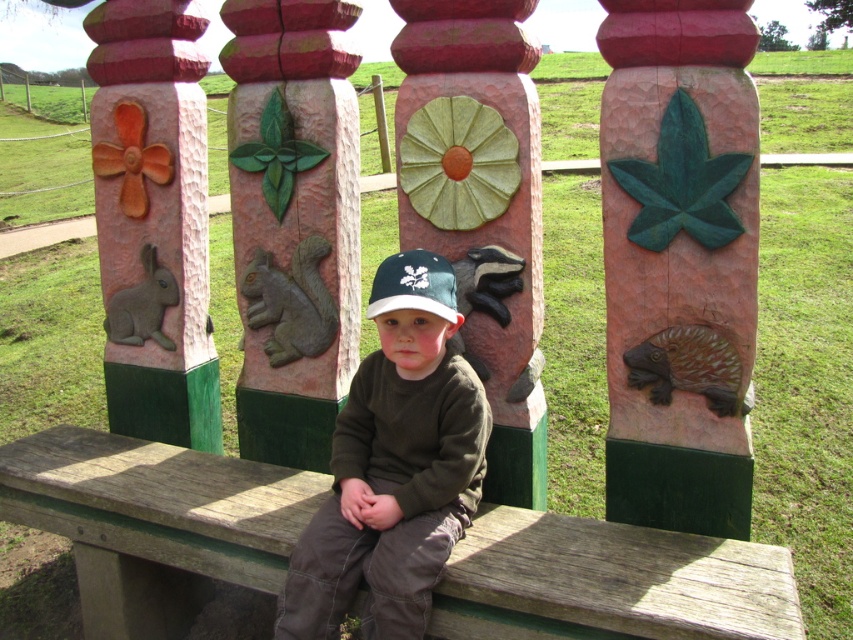
You are a photographer standing at the camera position. You want to take a photo of the green matte leaf at upper right. The camera has a maximum focus distance of 7 feet. Will the leaf be in focus?

The green matte leaf at upper right is 7.19 feet from the camera, which exceeds the maximum focus distance of 7 feet. Therefore, the leaf will not be in focus.

You are a photographer trying to capture the green matte leaf at upper right and the green matte baseball cap at center in the same frame. Which object should you focus on first to ensure both are in focus?

The green matte leaf at upper right is closer to the viewer than the green matte baseball cap at center. To ensure both are in focus, focus on the green matte leaf at upper right first, as it is the closer object, and the depth of field will extend to the farther object.